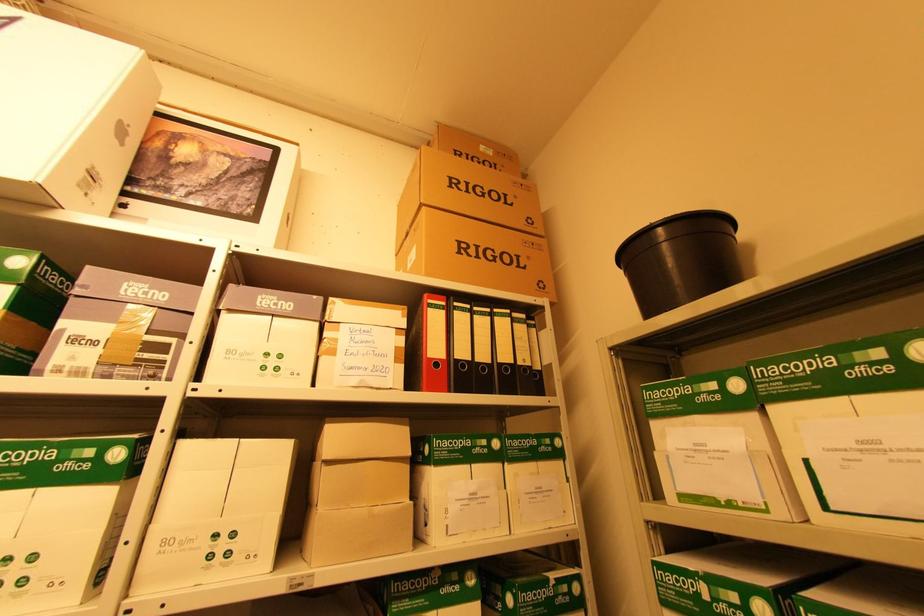
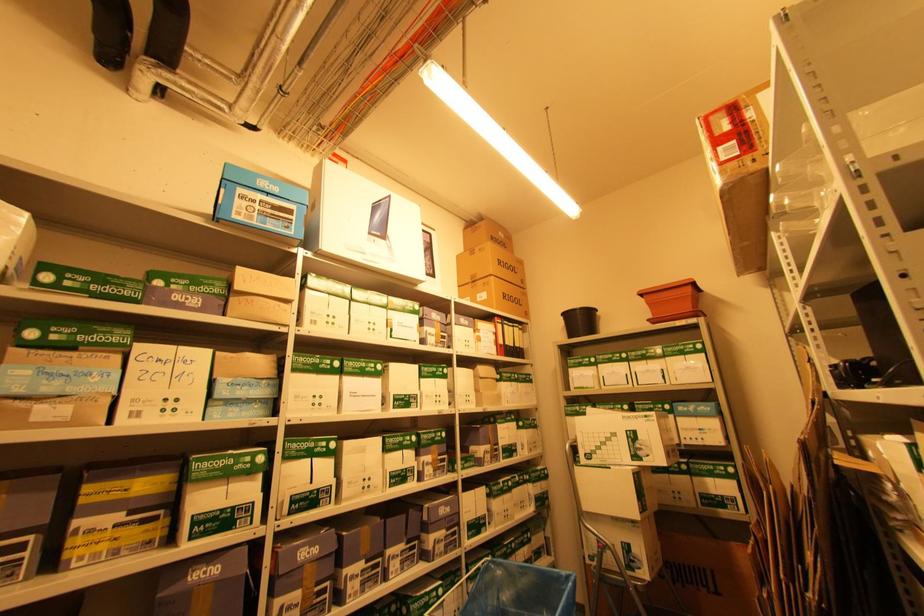
The images are taken continuously from a first-person perspective. In which direction are you moving?

The cameraman walked toward left, backward.